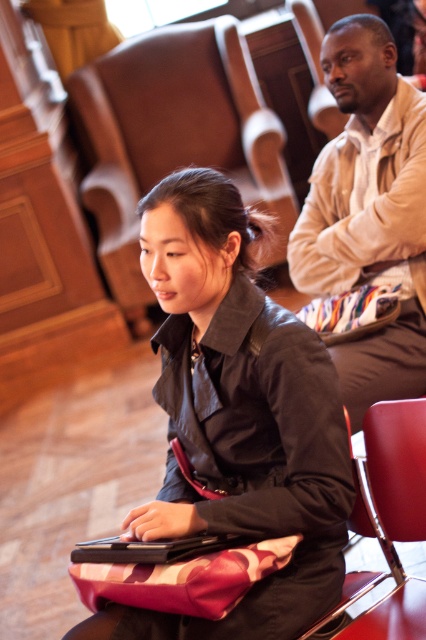
Does light beige shirt at upper right lie behind black matte laptop at center?

Yes, it is behind black matte laptop at center.

Is light beige shirt at upper right thinner than black matte laptop at center?

Incorrect, light beige shirt at upper right's width is not less than black matte laptop at center's.

Is point (331, 292) positioned before point (167, 548)?

No, (331, 292) is behind (167, 548).

Locate an element on the screen. This screenshot has width=426, height=640. light beige shirt at upper right is located at coordinates (368, 211).

Consider the image. Which is below, matte black jacket at center or black matte laptop at center?

black matte laptop at center

Does point (301, 372) come farther from viewer compared to point (190, 536)?

Yes, it is behind point (190, 536).

Is point (167, 472) farther from viewer compared to point (230, 538)?

Yes, it is behind point (230, 538).

At what (x,y) coordinates should I click in order to perform the action: click on matte black jacket at center. Please return your answer as a coordinate pair (x, y). The width and height of the screenshot is (426, 640). Looking at the image, I should click on (236, 417).

Does point (406, 579) come closer to viewer compared to point (106, 538)?

Yes, point (406, 579) is in front of point (106, 538).

Is the position of smooth leather armchair at lower right more distant than that of black matte laptop at center?

Yes.

I want to click on smooth leather armchair at lower right, so click(388, 515).

Locate an element on the screen. This screenshot has width=426, height=640. smooth leather armchair at lower right is located at coordinates (388, 515).